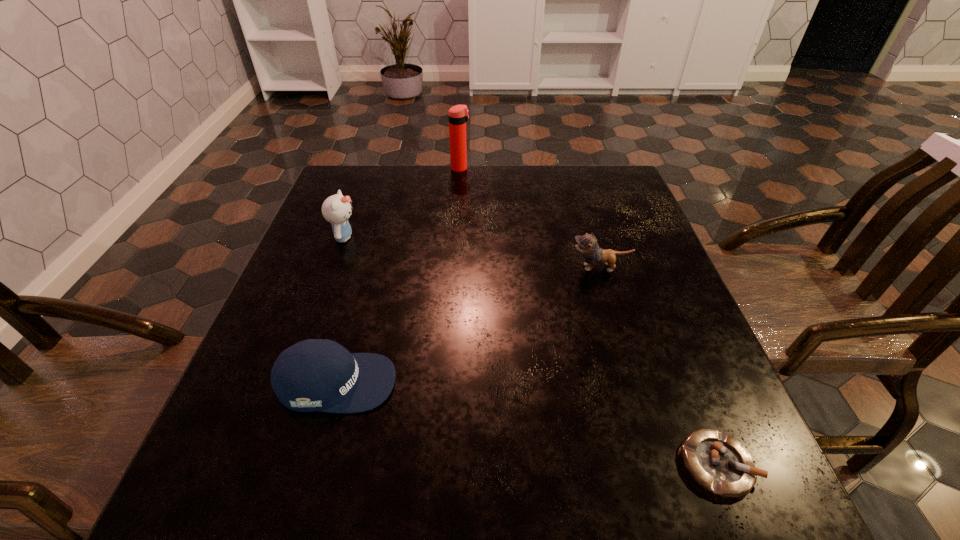
This screenshot has width=960, height=540. Find the location of `baseball cap at the left edge`. baseball cap at the left edge is located at coordinates (312, 375).

At what (x,y) coordinates should I click in order to perform the action: click on kitten that is positioned at the right edge. Please return your answer as a coordinate pair (x, y). This screenshot has width=960, height=540. Looking at the image, I should click on (587, 244).

This screenshot has height=540, width=960. I want to click on ashtray present at the right edge, so click(718, 463).

This screenshot has height=540, width=960. Find the location of `object that is positioned at the near right corner`. object that is positioned at the near right corner is located at coordinates (718, 463).

I want to click on vacant space at the far edge, so click(x=506, y=177).

Locate an element on the screen. This screenshot has height=540, width=960. vacant area at the near edge is located at coordinates (357, 488).

The image size is (960, 540). What are the coordinates of `vacant region at the left edge of the desktop` in the screenshot? It's located at (335, 322).

Where is `vacant region at the right edge of the desktop`? This screenshot has width=960, height=540. vacant region at the right edge of the desktop is located at coordinates (612, 212).

Image resolution: width=960 pixels, height=540 pixels. I want to click on free spot at the far left corner of the desktop, so click(x=385, y=192).

Where is `empty space that is in between the shortest object and the third farthest object`? This screenshot has width=960, height=540. empty space that is in between the shortest object and the third farthest object is located at coordinates (659, 366).